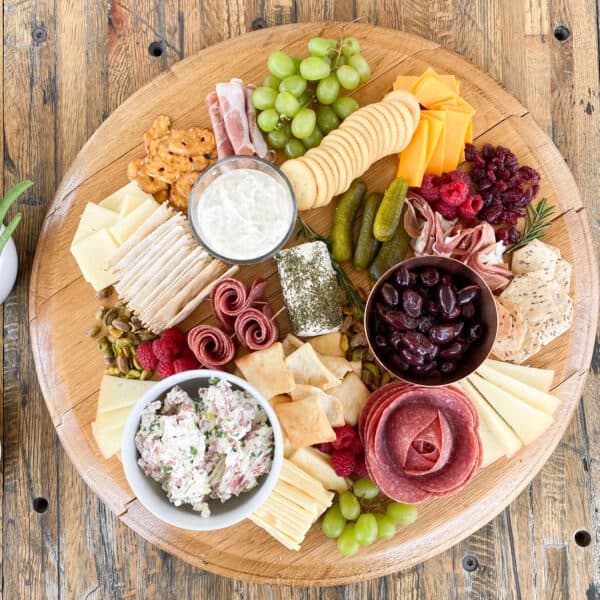
This screenshot has width=600, height=600. In order to click on white bowl in this screenshot , I will do `click(240, 508)`, `click(163, 385)`.